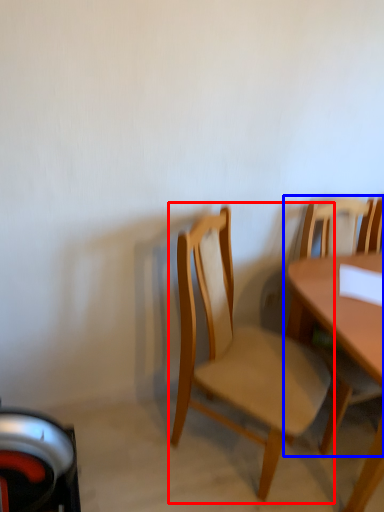
Question: Which point is closer to the camera, chair (highlighted by a red box) or chair (highlighted by a blue box)?

Choices:
 (A) chair
 (B) chair

Answer: (A)